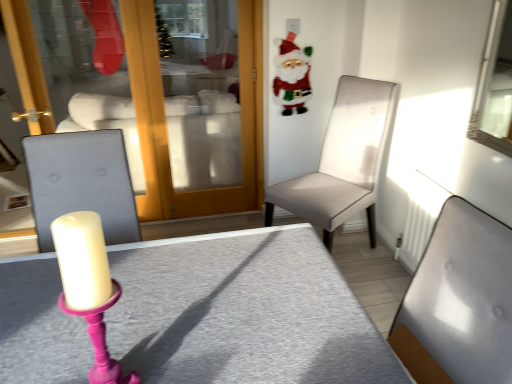
Question: Considering the relative sizes of felt santa claus at upper right and gray fabric table at center in the image provided, is felt santa claus at upper right taller than gray fabric table at center?

Choices:
 (A) no
 (B) yes

Answer: (A)

Question: Are felt santa claus at upper right and gray fabric table at center far apart?

Choices:
 (A) no
 (B) yes

Answer: (B)

Question: Is felt santa claus at upper right touching gray fabric table at center?

Choices:
 (A) no
 (B) yes

Answer: (A)

Question: Is felt santa claus at upper right not within gray fabric table at center?

Choices:
 (A) yes
 (B) no

Answer: (A)

Question: Is felt santa claus at upper right behind gray fabric table at center?

Choices:
 (A) yes
 (B) no

Answer: (A)

Question: From the image's perspective, is felt santa claus at upper right below gray fabric table at center?

Choices:
 (A) yes
 (B) no

Answer: (B)

Question: Can you confirm if light gray fabric chair at center, which is counted as the second chair, starting from the back, is shorter than gray fabric table at center?

Choices:
 (A) yes
 (B) no

Answer: (A)

Question: Is light gray fabric chair at center, which is counted as the second chair, starting from the back, thinner than gray fabric table at center?

Choices:
 (A) no
 (B) yes

Answer: (B)

Question: Can you confirm if light gray fabric chair at center, the first chair when ordered from front to back, is wider than gray fabric table at center?

Choices:
 (A) no
 (B) yes

Answer: (A)

Question: Does light gray fabric chair at center, which is counted as the second chair, starting from the back, contain gray fabric table at center?

Choices:
 (A) yes
 (B) no

Answer: (B)

Question: Is light gray fabric chair at center, the first chair when ordered from front to back, oriented away from gray fabric table at center?

Choices:
 (A) no
 (B) yes

Answer: (A)

Question: From a real-world perspective, is light gray fabric chair at center, which is counted as the second chair, starting from the back, on top of gray fabric table at center?

Choices:
 (A) no
 (B) yes

Answer: (B)

Question: From the image's perspective, is gray fabric table at center on top of light beige fabric chair at center right, which is the 1th chair in back-to-front order?

Choices:
 (A) no
 (B) yes

Answer: (A)